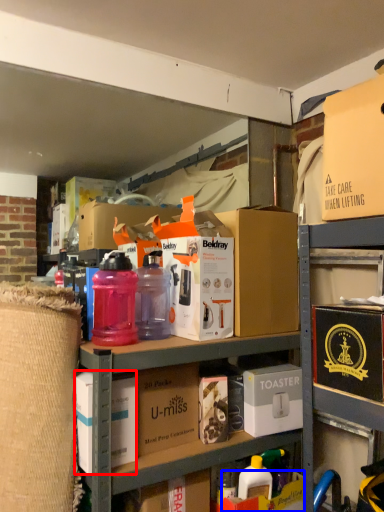
Question: Which point is closer to the camera, box (highlighted by a red box) or storage box (highlighted by a blue box)?

Choices:
 (A) box
 (B) storage box

Answer: (A)